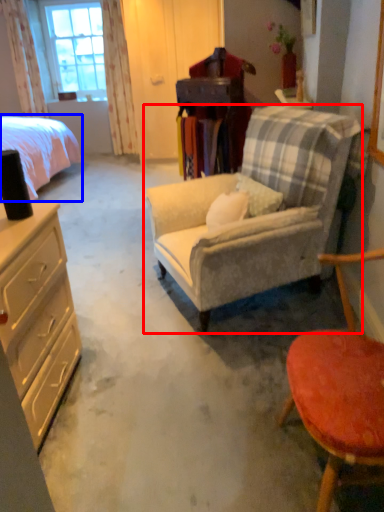
Question: Among these objects, which one is farthest to the camera, chair (highlighted by a red box) or bed (highlighted by a blue box)?

Choices:
 (A) chair
 (B) bed

Answer: (B)